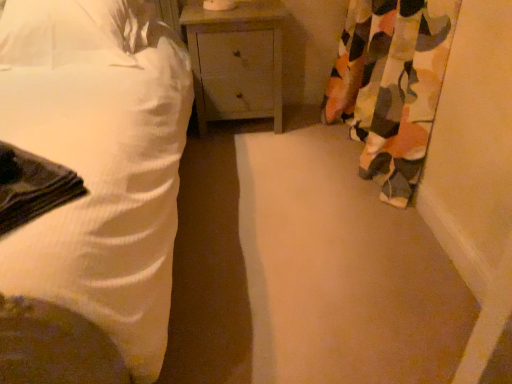
Locate an element on the screen. Image resolution: width=512 pixels, height=384 pixels. white fabric pillow at upper left is located at coordinates (70, 33).

Image resolution: width=512 pixels, height=384 pixels. Identify the location of camouflage fabric curtain at right. pos(391,86).

What do you see at coordinates (391, 86) in the screenshot? I see `camouflage fabric curtain at right` at bounding box center [391, 86].

Locate an element on the screen. The image size is (512, 384). white fabric pillow at upper left is located at coordinates (70, 33).

Image resolution: width=512 pixels, height=384 pixels. Find the location of `curtain that is behind the white textured bed at left`. curtain that is behind the white textured bed at left is located at coordinates coord(391,86).

Between white textured bed at left and camouflage fabric curtain at right, which one is positioned in front?

white textured bed at left.

Is white textured bed at left oriented towards camouflage fabric curtain at right?

No, white textured bed at left is not turned towards camouflage fabric curtain at right.

Considering the sizes of objects matte gray nightstand at center and camouflage fabric curtain at right in the image provided, who is smaller, matte gray nightstand at center or camouflage fabric curtain at right?

matte gray nightstand at center.

Is matte gray nightstand at center to the left of camouflage fabric curtain at right from the viewer's perspective?

Indeed, matte gray nightstand at center is positioned on the left side of camouflage fabric curtain at right.

Is point (255, 85) closer or farther from the camera than point (377, 88)?

Point (255, 85) is positioned farther from the camera compared to point (377, 88).

Consider the image. Would you say camouflage fabric curtain at right is part of matte gray nightstand at center's contents?

That's incorrect, camouflage fabric curtain at right is not inside matte gray nightstand at center.

Is white textured bed at left to the left or to the right of white fabric pillow at upper left in the image?

In the image, white textured bed at left appears on the left side of white fabric pillow at upper left.

Based on the photo, is white fabric pillow at upper left at the back of white textured bed at left?

Yes, white textured bed at left is positioned with its back facing white fabric pillow at upper left.

Is white textured bed at left far away from white fabric pillow at upper left?

No, there isn't a large distance between white textured bed at left and white fabric pillow at upper left.

Which of these two, white textured bed at left or white fabric pillow at upper left, is wider?

Wider between the two is white textured bed at left.

Is matte gray nightstand at center at the left side of white textured bed at left?

No, matte gray nightstand at center is not to the left of white textured bed at left.

Are matte gray nightstand at center and white textured bed at left located far from each other?

No.

Can you confirm if matte gray nightstand at center is wider than white textured bed at left?

In fact, matte gray nightstand at center might be narrower than white textured bed at left.

Considering the sizes of matte gray nightstand at center and white textured bed at left in the image, is matte gray nightstand at center bigger or smaller than white textured bed at left?

Considering their sizes, matte gray nightstand at center takes up less space than white textured bed at left.

In the scene shown: From a real-world perspective, who is located higher, matte gray nightstand at center or white fabric pillow at upper left?

white fabric pillow at upper left, from a real-world perspective.

Does matte gray nightstand at center come in front of white fabric pillow at upper left?

That is False.

Choose the correct answer: Is matte gray nightstand at center inside white fabric pillow at upper left or outside it?

matte gray nightstand at center is not enclosed by white fabric pillow at upper left.

Is point (409, 125) behind point (113, 19)?

No, it is not.

From the image's perspective, is camouflage fabric curtain at right beneath white fabric pillow at upper left?

Correct, camouflage fabric curtain at right appears lower than white fabric pillow at upper left in the image.

Who is bigger, camouflage fabric curtain at right or white fabric pillow at upper left?

camouflage fabric curtain at right.

Considering the relative sizes of camouflage fabric curtain at right and white fabric pillow at upper left in the image provided, is camouflage fabric curtain at right taller than white fabric pillow at upper left?

Yes.

Is white fabric pillow at upper left next to camouflage fabric curtain at right and touching it?

white fabric pillow at upper left and camouflage fabric curtain at right are not in contact.

Locate an element on the screen. The height and width of the screenshot is (384, 512). pillow that is behind the camouflage fabric curtain at right is located at coordinates (70, 33).

Is point (115, 16) closer or farther from the camera than point (378, 165)?

Clearly, point (115, 16) is closer to the camera than point (378, 165).

Is white fabric pillow at upper left thinner than camouflage fabric curtain at right?

Incorrect, the width of white fabric pillow at upper left is not less than that of camouflage fabric curtain at right.

The width and height of the screenshot is (512, 384). I want to click on curtain that is under the white textured bed at left (from a real-world perspective), so click(391, 86).

I want to click on curtain that appears below the matte gray nightstand at center (from the image's perspective), so click(x=391, y=86).

Considering their positions, is white textured bed at left positioned further to camouflage fabric curtain at right than matte gray nightstand at center?

Based on the image, white textured bed at left appears to be further to camouflage fabric curtain at right.

From the image, which object appears to be nearer to white fabric pillow at upper left, camouflage fabric curtain at right or white textured bed at left?

white textured bed at left.

From the image, which object appears to be nearer to matte gray nightstand at center, white fabric pillow at upper left or white textured bed at left?

white fabric pillow at upper left.

Looking at the image, which one is located further to matte gray nightstand at center, camouflage fabric curtain at right or white fabric pillow at upper left?

Among the two, white fabric pillow at upper left is located further to matte gray nightstand at center.

Which object lies nearer to the anchor point matte gray nightstand at center, white textured bed at left or white fabric pillow at upper left?

white fabric pillow at upper left is closer to matte gray nightstand at center.

Considering their positions, is white textured bed at left positioned closer to white fabric pillow at upper left than matte gray nightstand at center?

white textured bed at left is closer to white fabric pillow at upper left.

Based on the photo, when comparing their distances from camouflage fabric curtain at right, does white textured bed at left or white fabric pillow at upper left seem closer?

white textured bed at left lies closer to camouflage fabric curtain at right than the other object.

Looking at the image, which one is located further to camouflage fabric curtain at right, matte gray nightstand at center or white fabric pillow at upper left?

white fabric pillow at upper left lies further to camouflage fabric curtain at right than the other object.

Where is `pillow between white textured bed at left and matte gray nightstand at center in the front-back direction`? pillow between white textured bed at left and matte gray nightstand at center in the front-back direction is located at coordinates (70, 33).

The height and width of the screenshot is (384, 512). In order to click on curtain between white textured bed at left and matte gray nightstand at center in the front-back direction in this screenshot , I will do `click(391, 86)`.

You are a GUI agent. You are given a task and a screenshot of the screen. Output one action in this format:
    pyautogui.click(x=<x>, y=<y>)
    Task: Click on the nightstand situated between white fabric pillow at upper left and camouflage fabric curtain at right from left to right
    The height and width of the screenshot is (384, 512).
    Given the screenshot: What is the action you would take?
    pyautogui.click(x=236, y=63)

Identify the location of pillow between white textured bed at left and camouflage fabric curtain at right from left to right. The height and width of the screenshot is (384, 512). (70, 33).